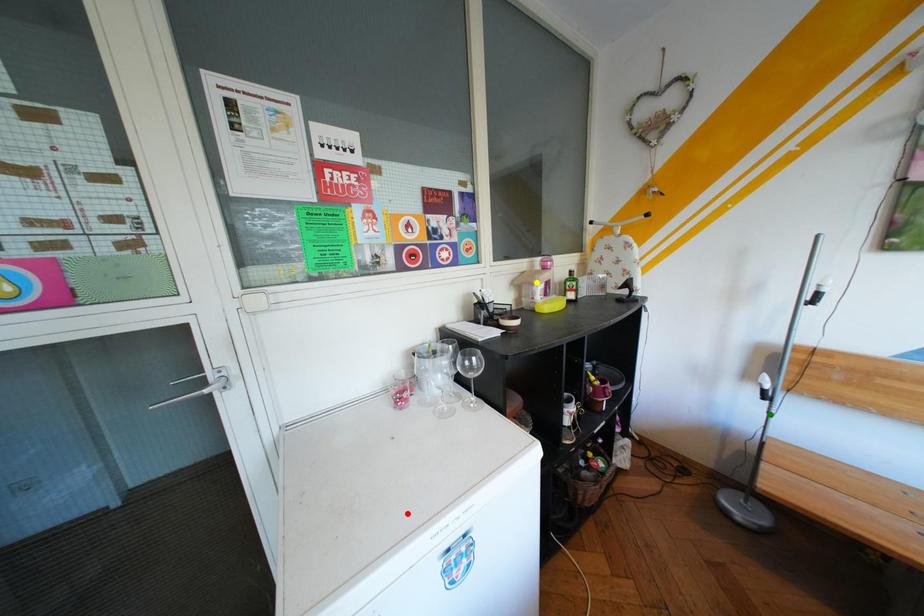
Order these from nearest to farthest:
1. red point
2. yellow point
3. green point

1. yellow point
2. green point
3. red point